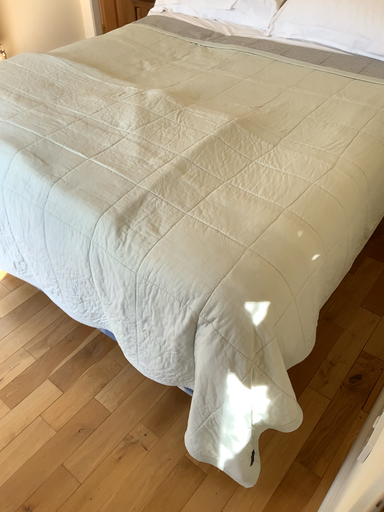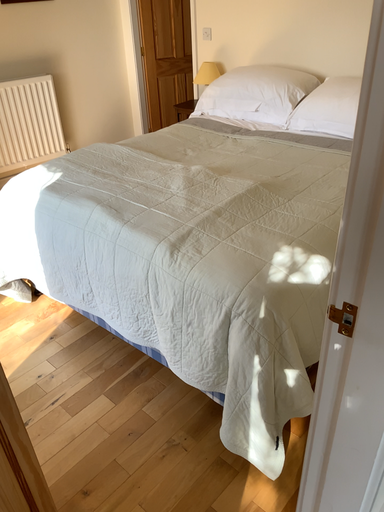
Question: Which way did the camera rotate in the video?

Choices:
 (A) rotated upward
 (B) rotated downward

Answer: (A)